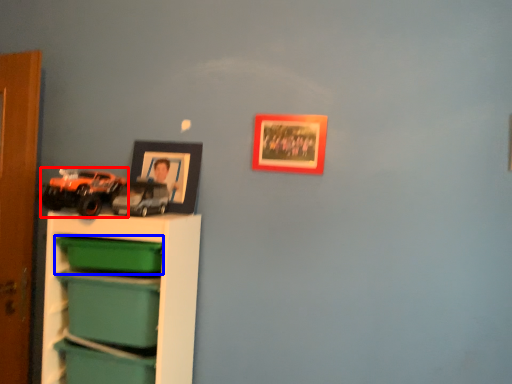
Question: Which object appears farthest to the camera in this image, toy (highlighted by a red box) or storage box (highlighted by a blue box)?

Choices:
 (A) toy
 (B) storage box

Answer: (B)